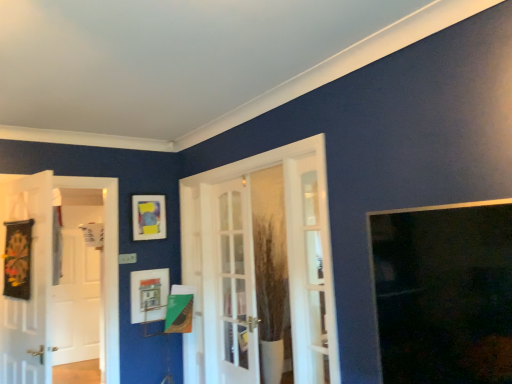
Question: Which direction should I rotate to look at matte white picture frame at center, which is counted as the 2th picture frame, starting from the top, — up or down?

Choices:
 (A) down
 (B) up

Answer: (A)

Question: Considering the relative sizes of matte plastic picture frame at upper left, the 2th picture frame in the bottom-to-top sequence, and white glossy screen door at left in the image provided, is matte plastic picture frame at upper left, the 2th picture frame in the bottom-to-top sequence, bigger than white glossy screen door at left?

Choices:
 (A) yes
 (B) no

Answer: (B)

Question: Is matte plastic picture frame at upper left, which is the 1th picture frame in top-to-bottom order, smaller than white glossy screen door at left?

Choices:
 (A) no
 (B) yes

Answer: (B)

Question: From a real-world perspective, is matte plastic picture frame at upper left, the 2th picture frame in the bottom-to-top sequence, under white glossy screen door at left?

Choices:
 (A) yes
 (B) no

Answer: (B)

Question: Does matte plastic picture frame at upper left, which is the 1th picture frame in top-to-bottom order, come in front of white glossy screen door at left?

Choices:
 (A) yes
 (B) no

Answer: (A)

Question: Can you confirm if matte plastic picture frame at upper left, which is the 1th picture frame in top-to-bottom order, is wider than white glossy screen door at left?

Choices:
 (A) no
 (B) yes

Answer: (B)

Question: Is matte plastic picture frame at upper left, the 2th picture frame in the bottom-to-top sequence, at the left side of white glossy screen door at left?

Choices:
 (A) no
 (B) yes

Answer: (A)

Question: From a real-world perspective, does black fabric banner at left, which is counted as the first door, starting from the left, sit lower than matte plastic picture frame at upper left, which is the 1th picture frame in top-to-bottom order?

Choices:
 (A) yes
 (B) no

Answer: (A)

Question: Is black fabric banner at left, which is counted as the first door, starting from the left, positioned behind matte plastic picture frame at upper left, which is the 1th picture frame in top-to-bottom order?

Choices:
 (A) yes
 (B) no

Answer: (B)

Question: Can matte plastic picture frame at upper left, which is the 1th picture frame in top-to-bottom order, be found inside black fabric banner at left, which is the third door in right-to-left order?

Choices:
 (A) no
 (B) yes

Answer: (A)

Question: Would you say black fabric banner at left, which is the third door in right-to-left order, is outside matte plastic picture frame at upper left, which is the 1th picture frame in top-to-bottom order?

Choices:
 (A) no
 (B) yes

Answer: (B)

Question: Is black fabric banner at left, which is the third door in right-to-left order, thinner than matte plastic picture frame at upper left, which is the 1th picture frame in top-to-bottom order?

Choices:
 (A) no
 (B) yes

Answer: (A)

Question: Considering the relative sizes of black fabric banner at left, which is counted as the first door, starting from the left, and matte plastic picture frame at upper left, the 2th picture frame in the bottom-to-top sequence, in the image provided, is black fabric banner at left, which is counted as the first door, starting from the left, wider than matte plastic picture frame at upper left, the 2th picture frame in the bottom-to-top sequence,?

Choices:
 (A) no
 (B) yes

Answer: (B)

Question: Is transparent glass window at upper right looking in the opposite direction of matte plastic picture frame at upper left, which is the 1th picture frame in top-to-bottom order?

Choices:
 (A) yes
 (B) no

Answer: (B)